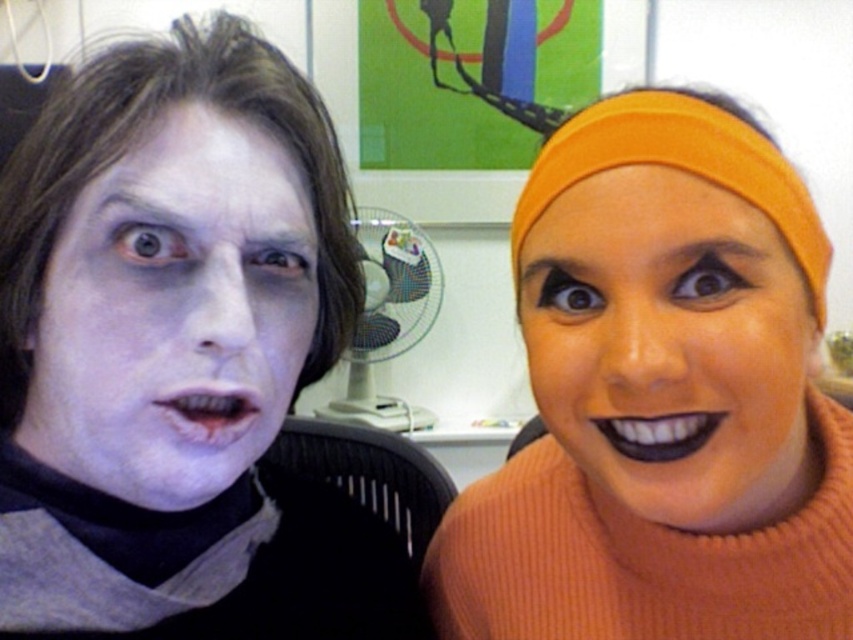
You are an artist trying to sketch the scene described. You need to place the pale matte face at left accurately on your canvas. According to the coordinates provided, where should you position it relative to the center of the canvas?

The pale matte face at left is located at point [173,310], which means it is positioned slightly to the left and above the center of the canvas.

You are a photographer standing at a distance of 10 inches from the scene. You want to capture a closeup shot of the orange fabric headband at upper right without including any other objects in the frame. Is the headband within your camera lens range?

The orange fabric headband at upper right is 12.89 inches away from the viewer. Since you are standing 10 inches away from the scene, the headband is 2.89 inches beyond your current position. To capture it without other objects, you need to move closer by approximately 2.89 inches or adjust the lens focus.